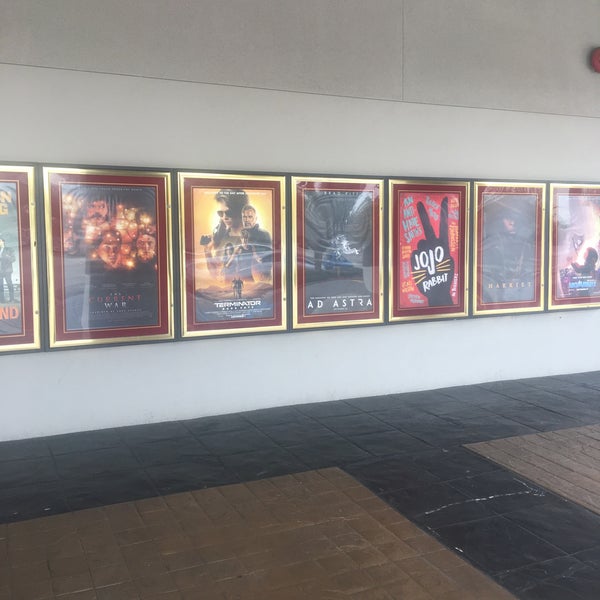
Where is `poster frame`? This screenshot has height=600, width=600. poster frame is located at coordinates (x=134, y=174).